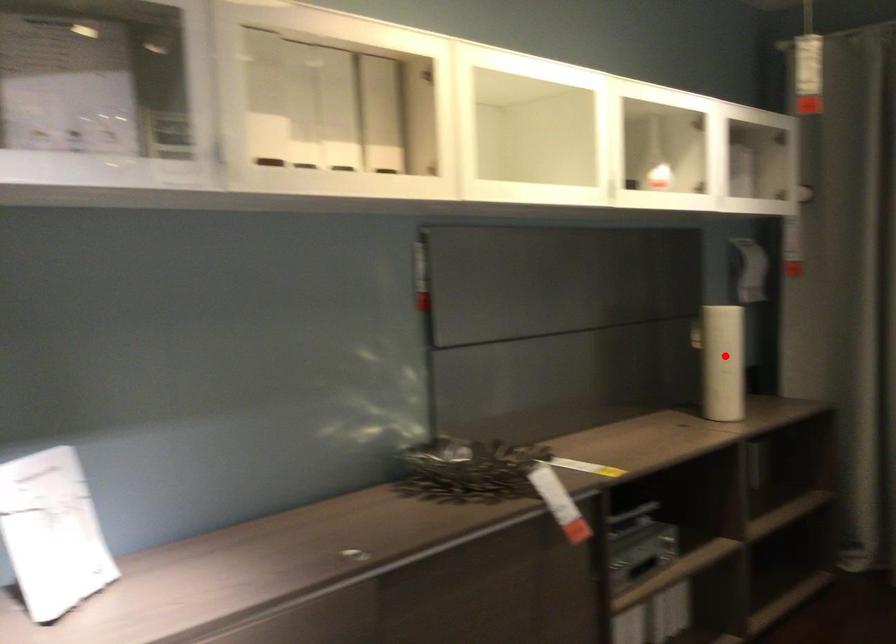
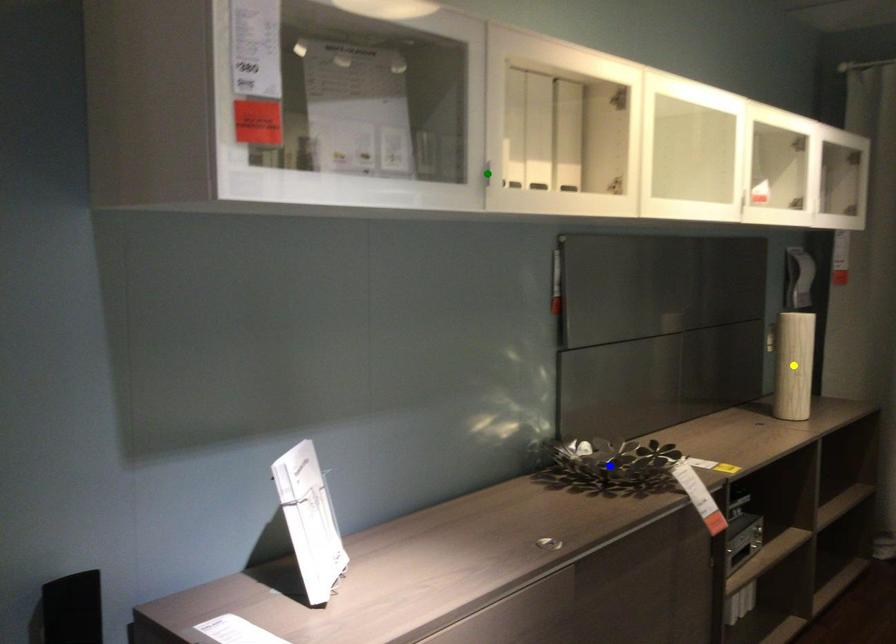
Question: I am providing you with two images of the same scene from different viewpoints. A red point is marked on the first image. You are given multiple points on the second image. In image 2, which mark is for the same physical point as the one in image 1?

Choices:
 (A) yellow point
 (B) blue point
 (C) green point

Answer: (A)